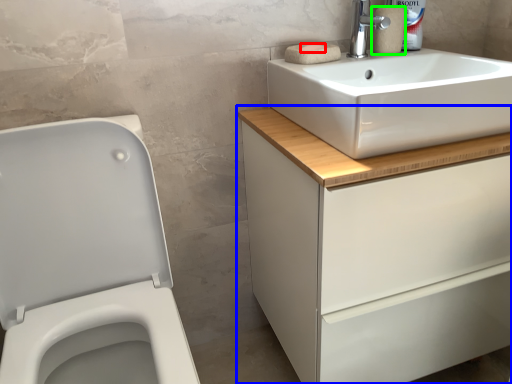
Question: Which object is the closest to the soap (highlighted by a red box)? Choose among these: bathroom cabinet (highlighted by a blue box) or toilet paper (highlighted by a green box).

Choices:
 (A) bathroom cabinet
 (B) toilet paper

Answer: (B)